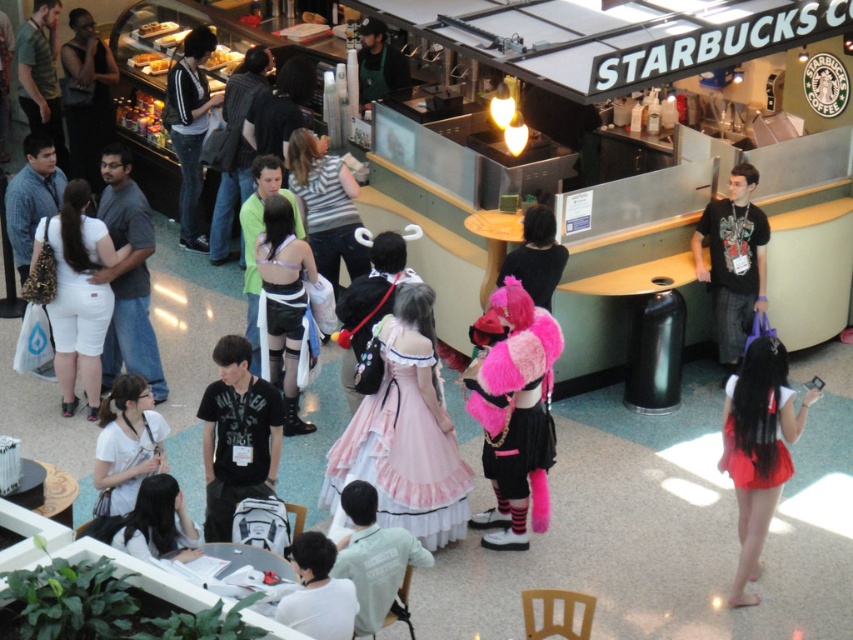
You are a photographer trying to capture a candid shot of the fuzzy pink skirt at center and the dark gray hoodie at upper left. Which object should you zoom in on to get a clearer image of its details without moving your camera position?

The fuzzy pink skirt at center is thinner than the dark gray hoodie at upper left, so you should zoom in on the fuzzy pink skirt at center to capture its details more clearly since it is closer to the camera.

You are a photographer trying to capture a clear shot of both the fuzzy pink skirt at center and the black fuzzy hat at center from the front. Considering their heights, which object should you focus on first to ensure both are in frame?

Since the fuzzy pink skirt at center is taller than the black fuzzy hat at center, you should focus on the fuzzy pink skirt at center first to ensure both are in frame.

You are standing at the entrance of the Starbucks coffee shop in the shopping mall. You notice a pink satin dress at center located at point (404,445). If you want to reach the dress without crossing any obstacles, which direction should you move from your current position?

The pink satin dress at center is located at point (404,445). Since you are at the entrance, you should move towards the center of the Starbucks coffee shop to reach the dress without obstacles.